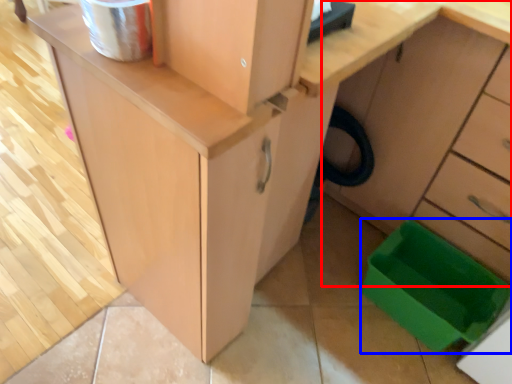
Question: Among these objects, which one is nearest to the camera, cabinetry (highlighted by a red box) or storage box (highlighted by a blue box)?

Choices:
 (A) cabinetry
 (B) storage box

Answer: (A)